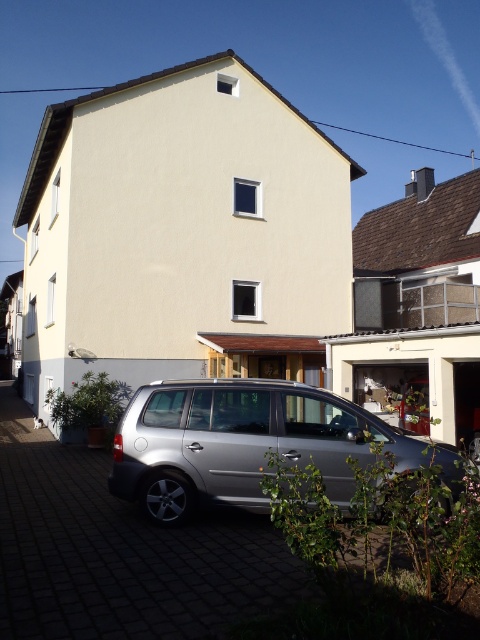
You are a delivery person trying to park a 10 feet long delivery truck between the silver metallic car at lower center and the satin silver van at lower center. Can you fit the truck in the space between them?

The distance between the silver metallic car at lower center and the satin silver van at lower center is 5.01 feet. Since the delivery truck is 10 feet long, it cannot fit in the space between them.

You are a delivery person trying to park your vehicle in the driveway. The driveway has space for one more vehicle. You have a vehicle that is the same size as the satin silver van at lower center. Can you fit your vehicle in the available space without moving the silver metallic car at lower center?

The silver metallic car at lower center is larger in size than the satin silver van at lower center. Since your vehicle is the same size as the satin silver van at lower center, it should fit in the available space without needing to move the silver metallic car at lower center.